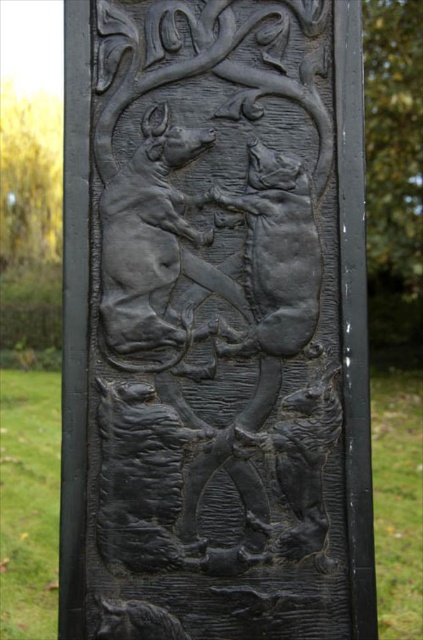
You are examining the stone relief and notice two points marked on it. The first point is located at coordinates point (313, 550) and the second at point (24, 145). If you were to touch both points with your finger, which one would feel closer to your hand?

Point (313, 550) is closer to the camera than point (24, 145), so touching it would feel closer to your hand.

You are an archaeologist examining the stone relief. You notice a specific point marked at coordinates (214, 324). What is the significance of this point in relation to the relief?

The point at coordinates (214, 324) marks the black matte relief at center, indicating its central position in the carving.